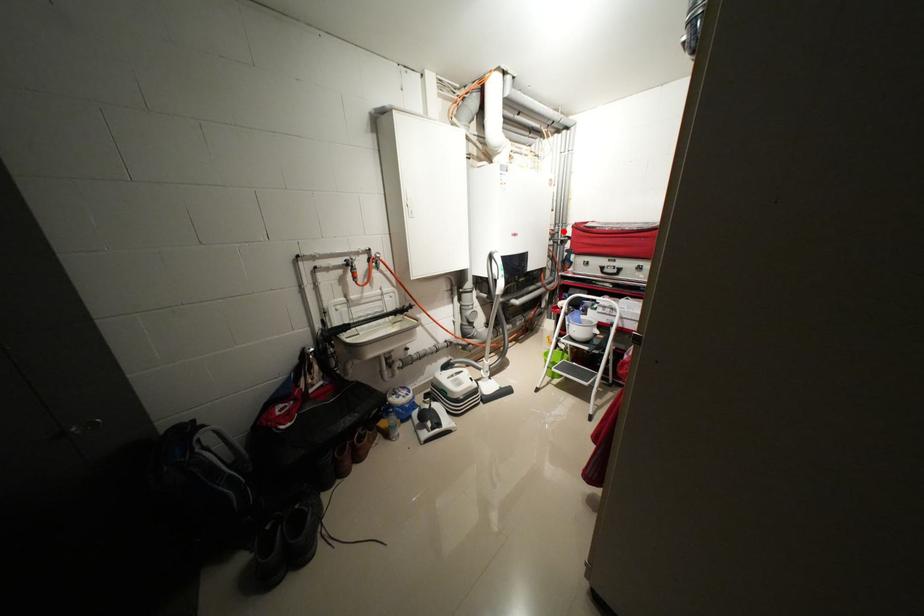
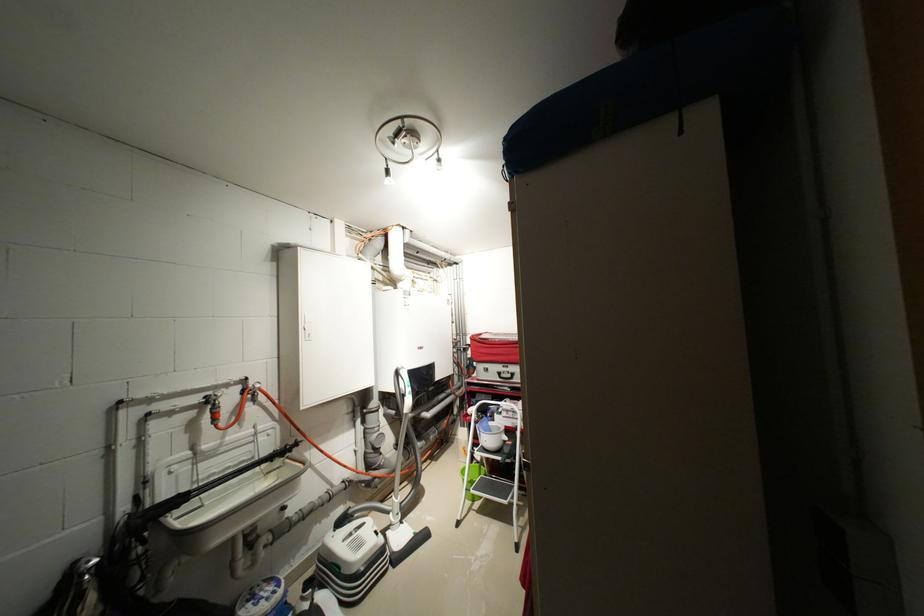
Question: I am providing you with two images of the same scene from different viewpoints. A red point is shown in image1. For the corresponding object point in image2, is it positioned nearer or farther from the camera?

Choices:
 (A) Nearer
 (B) Farther

Answer: (B)